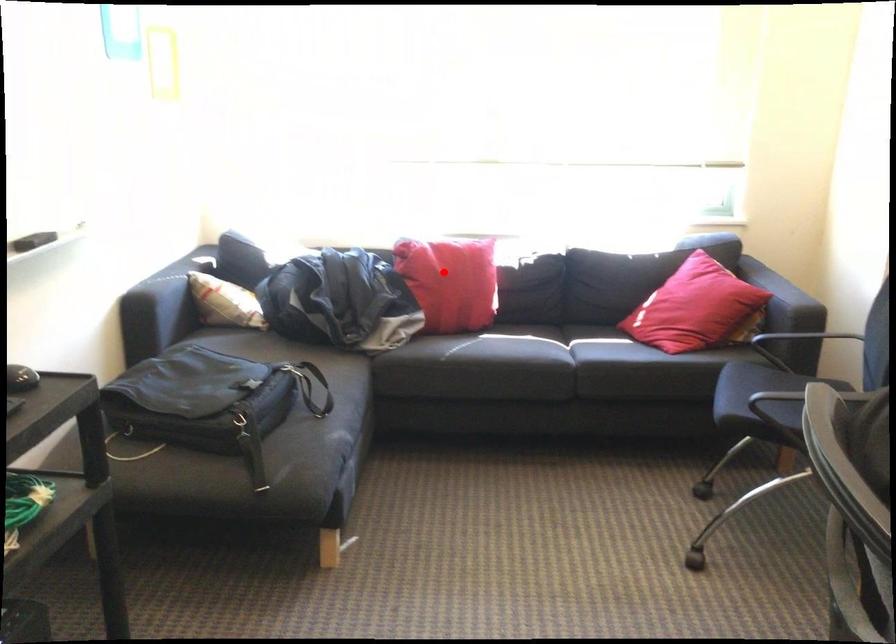
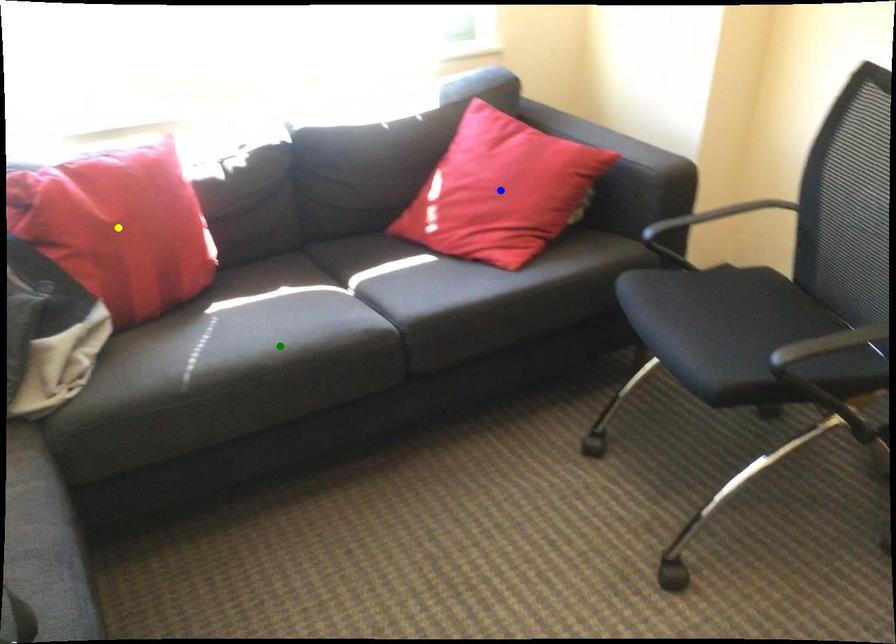
Question: I am providing you with two images of the same scene from different viewpoints. A red point is marked on the first image. You are given multiple points on the second image. Which point in image 2 represents the same 3d spot as the red point in image 1?

Choices:
 (A) blue point
 (B) yellow point
 (C) green point

Answer: (B)